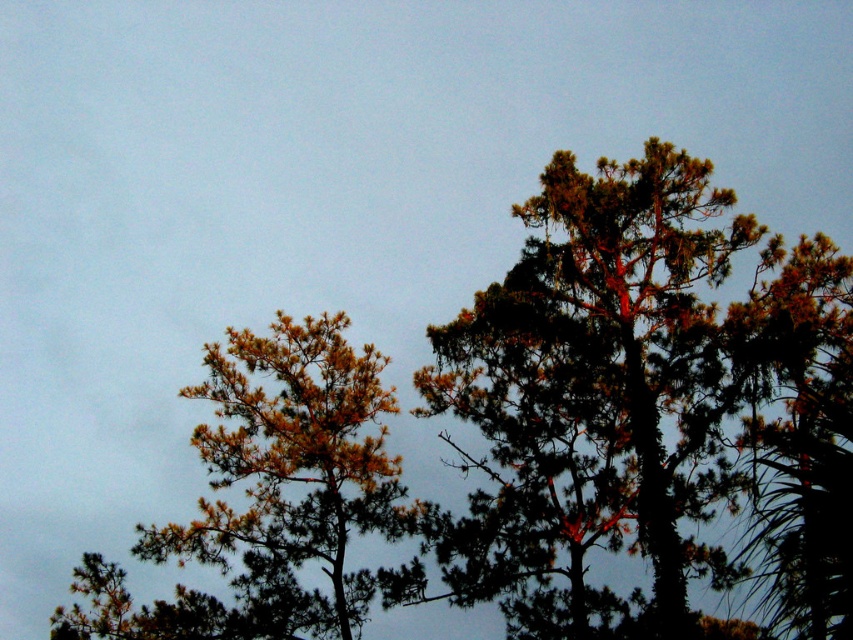
Does dark green textured tree at upper right come in front of green needle-like at upper right?

Yes, dark green textured tree at upper right is in front of green needle-like at upper right.

Who is taller, dark green textured tree at upper right or green needle-like at upper right?

dark green textured tree at upper right is taller.

The image size is (853, 640). Identify the location of dark green textured tree at upper right. (646, 404).

This screenshot has height=640, width=853. I want to click on dark green textured tree at upper right, so click(x=646, y=404).

Can you confirm if dull yellow-green needles at left is positioned above green needle-like at upper right?

No, dull yellow-green needles at left is not above green needle-like at upper right.

Between dull yellow-green needles at left and green needle-like at upper right, which one is positioned higher?

green needle-like at upper right is higher up.

Find the location of a particular element. The width and height of the screenshot is (853, 640). dull yellow-green needles at left is located at coordinates (271, 497).

Which is behind, point (550, 440) or point (228, 404)?

The point (228, 404) is more distant.

Does dark green textured tree at upper right have a larger size compared to dull yellow-green needles at left?

Correct, dark green textured tree at upper right is larger in size than dull yellow-green needles at left.

The height and width of the screenshot is (640, 853). Find the location of `dark green textured tree at upper right`. dark green textured tree at upper right is located at coordinates (646, 404).